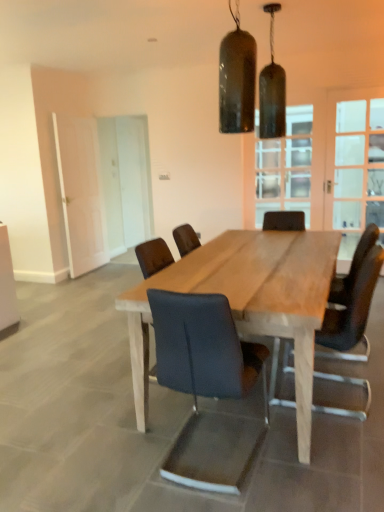
Question: Would you say white matte door at left, which is the first screen door from left to right, is part of clear glass window at upper center's contents?

Choices:
 (A) yes
 (B) no

Answer: (B)

Question: Is clear glass window at upper center positioned in front of white matte door at left, which is the first screen door from left to right?

Choices:
 (A) no
 (B) yes

Answer: (B)

Question: Can you confirm if clear glass window at upper center is bigger than white matte door at left, the 2th screen door from the right?

Choices:
 (A) yes
 (B) no

Answer: (B)

Question: Is clear glass window at upper center aimed at white matte door at left, the 2th screen door from the right?

Choices:
 (A) no
 (B) yes

Answer: (A)

Question: From a real-world perspective, is clear glass window at upper center beneath white matte door at left, which is the first screen door from left to right?

Choices:
 (A) yes
 (B) no

Answer: (B)

Question: Is clear glass window at upper center facing away from white matte door at left, the 2th screen door from the right?

Choices:
 (A) yes
 (B) no

Answer: (B)

Question: Considering the relative sizes of matte black pendant light at upper center, the second lamp viewed from the left, and matte black chair at center, placed as the 2th chair when sorted from left to right, in the image provided, is matte black pendant light at upper center, the second lamp viewed from the left, taller than matte black chair at center, placed as the 2th chair when sorted from left to right,?

Choices:
 (A) yes
 (B) no

Answer: (B)

Question: Does matte black pendant light at upper center, which ranks as the first lamp in back-to-front order, lie in front of matte black chair at center, the second chair viewed from the right?

Choices:
 (A) no
 (B) yes

Answer: (A)

Question: Would you say matte black pendant light at upper center, acting as the 1th lamp starting from the right, is outside matte black chair at center, placed as the 2th chair when sorted from left to right?

Choices:
 (A) yes
 (B) no

Answer: (A)

Question: Can you confirm if matte black pendant light at upper center, which ranks as the first lamp in back-to-front order, is smaller than matte black chair at center, placed as the 2th chair when sorted from left to right?

Choices:
 (A) yes
 (B) no

Answer: (A)

Question: Does matte black pendant light at upper center, the second lamp viewed from the left, have a lesser width compared to matte black chair at center, the second chair viewed from the right?

Choices:
 (A) no
 (B) yes

Answer: (B)

Question: Is matte black pendant light at upper center, which ranks as the first lamp in back-to-front order, oriented towards matte black chair at center, the second chair viewed from the right?

Choices:
 (A) no
 (B) yes

Answer: (A)

Question: Is white glass screen door at left, marked as the 2th screen door in a left-to-right arrangement, at the left side of natural wood table at center?

Choices:
 (A) no
 (B) yes

Answer: (B)